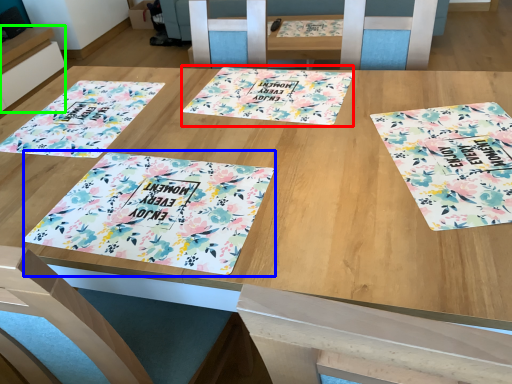
Question: Which object is positioned closest to yoga mat (highlighted by a red box)? Select from tablecloth (highlighted by a blue box) and table (highlighted by a green box).

Choices:
 (A) tablecloth
 (B) table

Answer: (A)